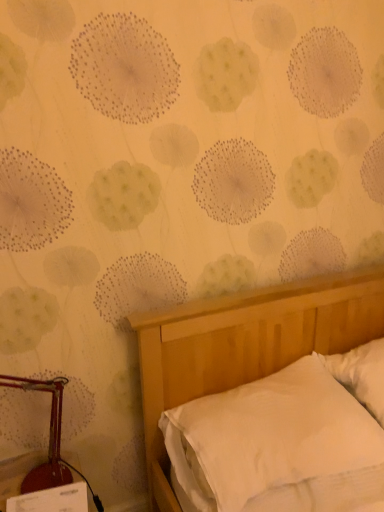
Question: Is white smooth bed at lower right completely or partially outside of white soft pillow at right?

Choices:
 (A) yes
 (B) no

Answer: (A)

Question: Can you confirm if white smooth bed at lower right is shorter than white soft pillow at right?

Choices:
 (A) yes
 (B) no

Answer: (A)

Question: Considering the relative sizes of white smooth bed at lower right and white soft pillow at right in the image provided, is white smooth bed at lower right taller than white soft pillow at right?

Choices:
 (A) yes
 (B) no

Answer: (B)

Question: Does white smooth bed at lower right appear on the left side of white soft pillow at right?

Choices:
 (A) no
 (B) yes

Answer: (B)

Question: Is white smooth bed at lower right facing towards white soft pillow at right?

Choices:
 (A) yes
 (B) no

Answer: (B)

Question: Is white smooth bed at lower right inside or outside of white soft pillow at right?

Choices:
 (A) inside
 (B) outside

Answer: (B)

Question: Is point (157, 474) positioned closer to the camera than point (377, 344)?

Choices:
 (A) closer
 (B) farther

Answer: (A)

Question: Is white smooth bed at lower right taller or shorter than white soft pillow at right?

Choices:
 (A) tall
 (B) short

Answer: (B)

Question: From the image's perspective, is white smooth bed at lower right located above or below white soft pillow at right?

Choices:
 (A) below
 (B) above

Answer: (A)

Question: From a real-world perspective, is metallic red lamp at left positioned above or below white smooth bed at lower right?

Choices:
 (A) above
 (B) below

Answer: (A)

Question: Considering the positions of metallic red lamp at left and white smooth bed at lower right in the image, is metallic red lamp at left taller or shorter than white smooth bed at lower right?

Choices:
 (A) tall
 (B) short

Answer: (A)

Question: Based on their sizes in the image, would you say metallic red lamp at left is bigger or smaller than white smooth bed at lower right?

Choices:
 (A) big
 (B) small

Answer: (B)

Question: Choose the correct answer: Is metallic red lamp at left inside white smooth bed at lower right or outside it?

Choices:
 (A) outside
 (B) inside

Answer: (A)

Question: Is point (344, 374) closer or farther from the camera than point (34, 473)?

Choices:
 (A) closer
 (B) farther

Answer: (B)

Question: From a real-world perspective, is white soft pillow at right physically located above or below metallic red lamp at left?

Choices:
 (A) above
 (B) below

Answer: (B)